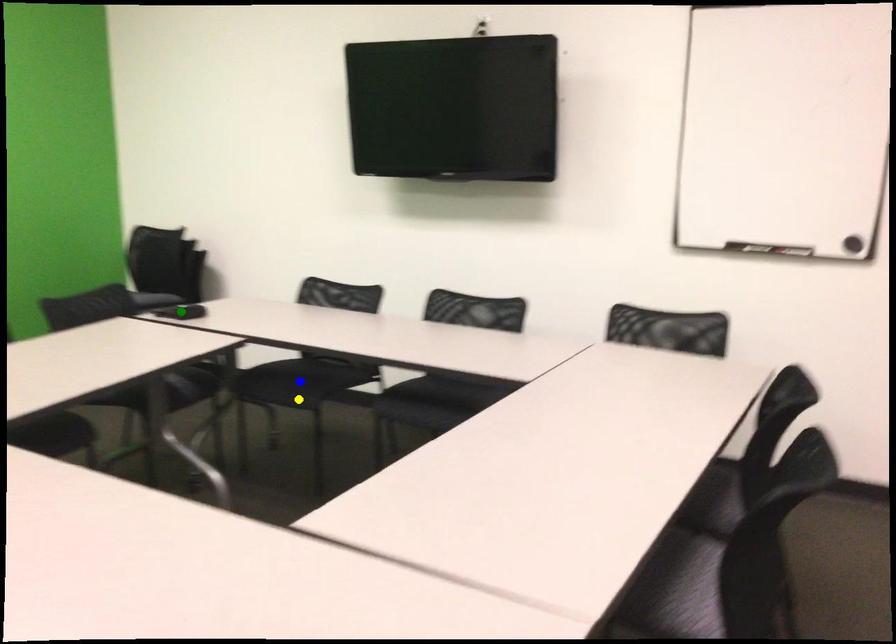
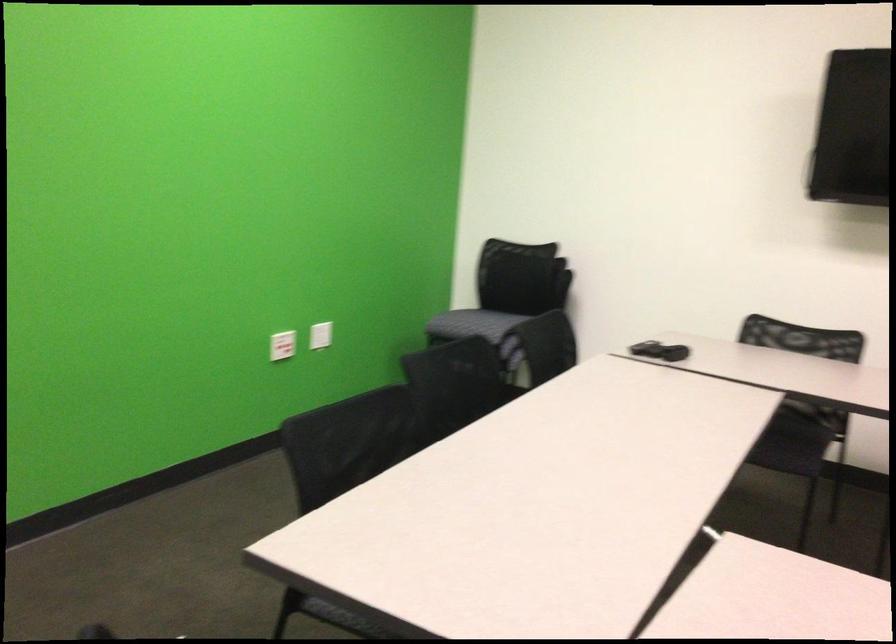
I am providing you with two images of the same scene from different viewpoints. Three points are marked in image1. Which point corresponds to a part or object that is occluded in image2?In image1, three points are marked. Which of them correspond to a part or object that is occluded in image2?Among the three points shown in image1, which one corresponds to a part or object that is no longer visible due to occlusion in image2?

green point cannot be seen in image2.